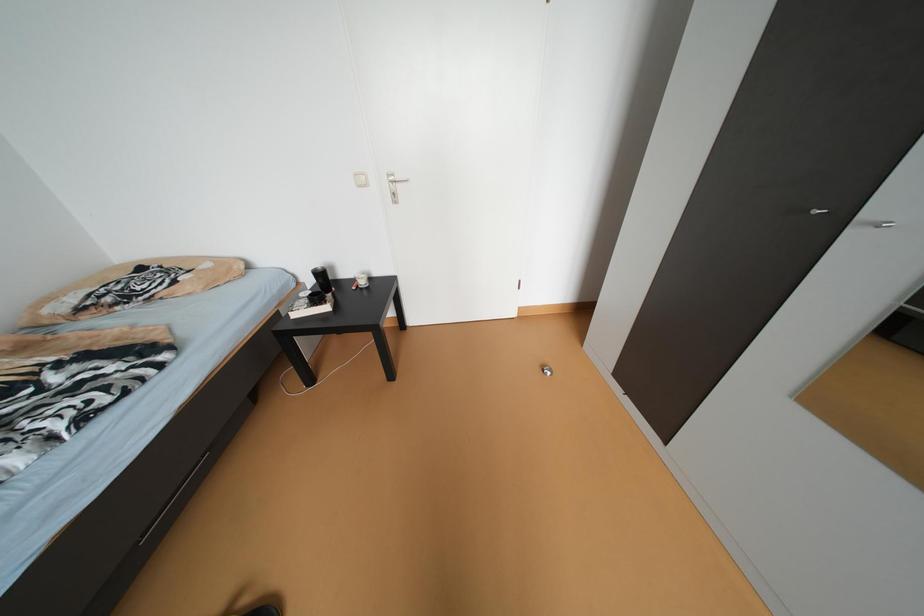
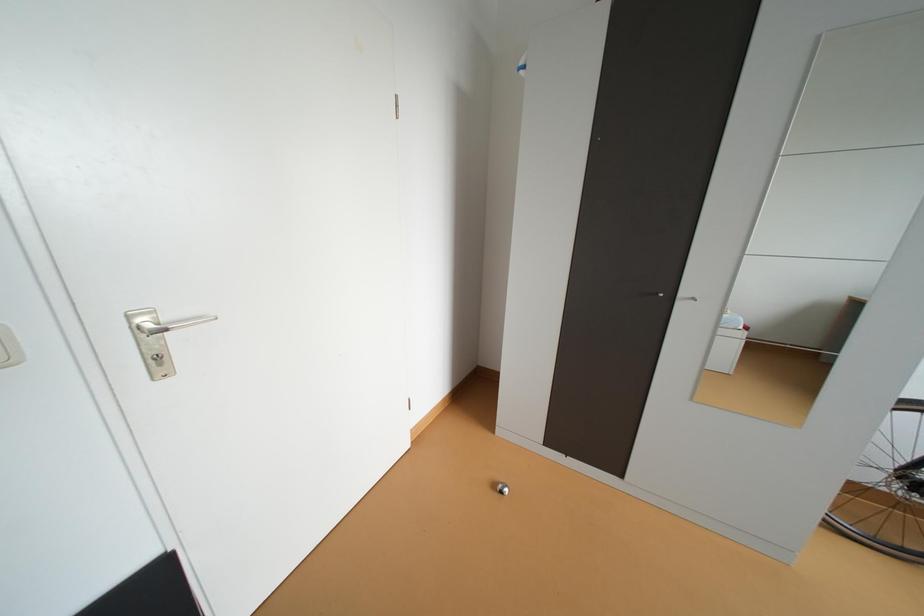
Question: The camera is either moving clockwise (left) or counter-clockwise (right) around the object. The first image is from the beginning of the video and the second image is from the end. Is the camera moving left or right when shooting the video?

Choices:
 (A) Left
 (B) Right

Answer: (A)